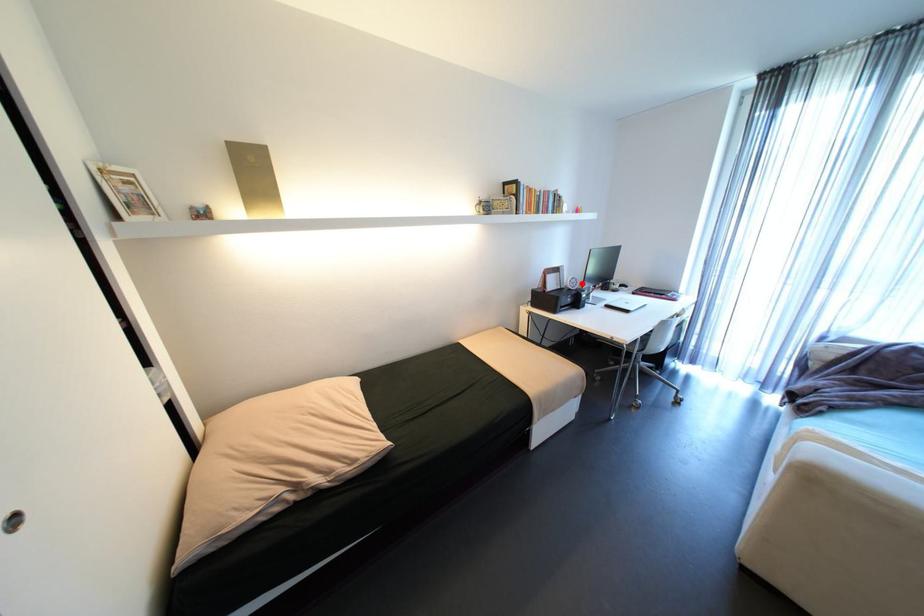
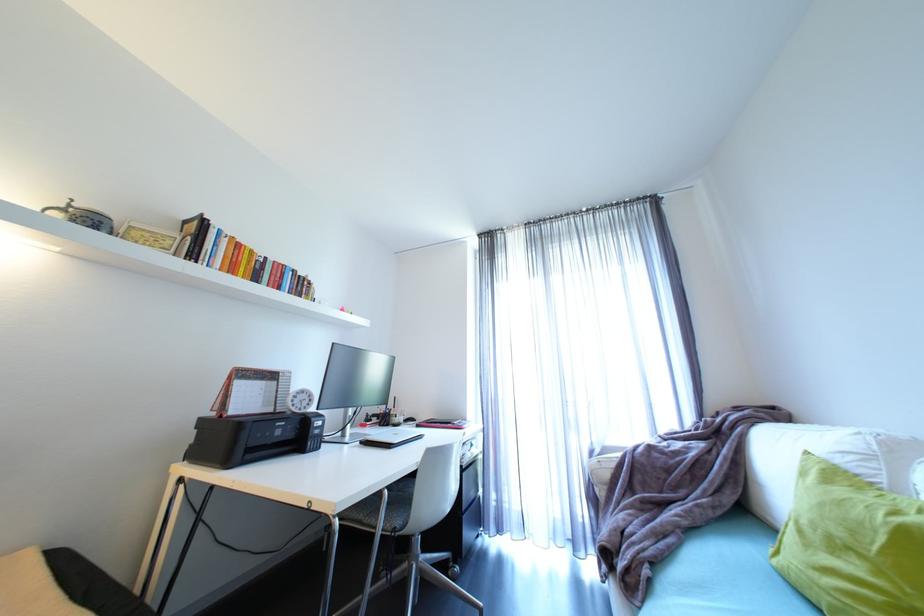
Where in the second image is the point corresponding to the highlighted location from the first image?

(312, 402)